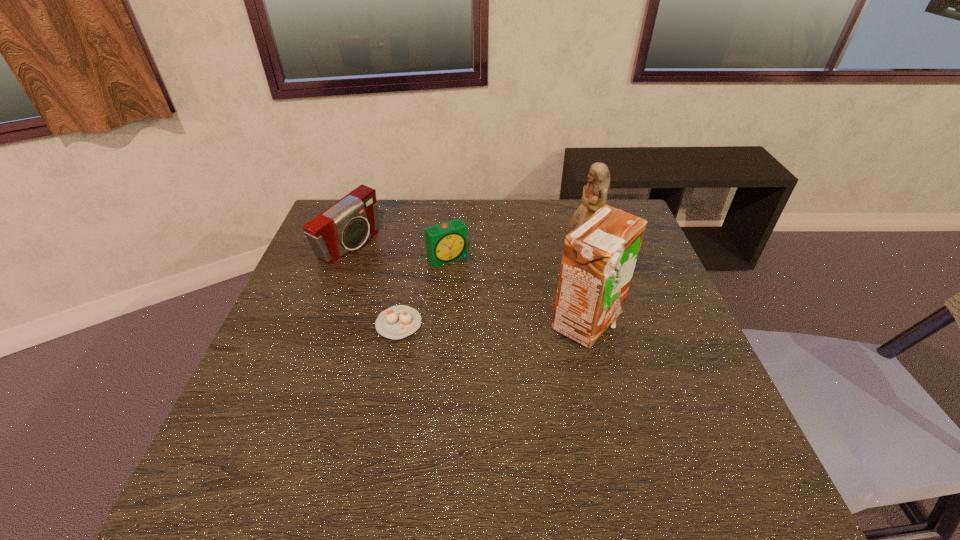
What are the coordinates of `carton situated at the right edge` in the screenshot? It's located at (599, 257).

Identify the location of figurine that is at the right edge. (594, 197).

Identify the location of object positioned at the far left corner. (345, 226).

This screenshot has height=540, width=960. What are the coordinates of `object situated at the far right corner` in the screenshot? It's located at (594, 197).

In order to click on vacant region at the far edge in this screenshot , I will do `click(533, 206)`.

Locate an element on the screen. The height and width of the screenshot is (540, 960). free space at the left edge is located at coordinates (317, 374).

Where is `vacant space at the right edge of the desktop`? The height and width of the screenshot is (540, 960). vacant space at the right edge of the desktop is located at coordinates (627, 346).

Where is `free area in between the alarm clock and the carton`? Image resolution: width=960 pixels, height=540 pixels. free area in between the alarm clock and the carton is located at coordinates (517, 291).

You are a GUI agent. You are given a task and a screenshot of the screen. Output one action in this format:
    pyautogui.click(x=<x>, y=<y>)
    Task: Click on the blank region between the figurine and the alarm clock
    This screenshot has height=540, width=960.
    Given the screenshot: What is the action you would take?
    pyautogui.click(x=514, y=254)

This screenshot has height=540, width=960. I want to click on vacant area that lies between the shortest object and the carton, so click(x=492, y=324).